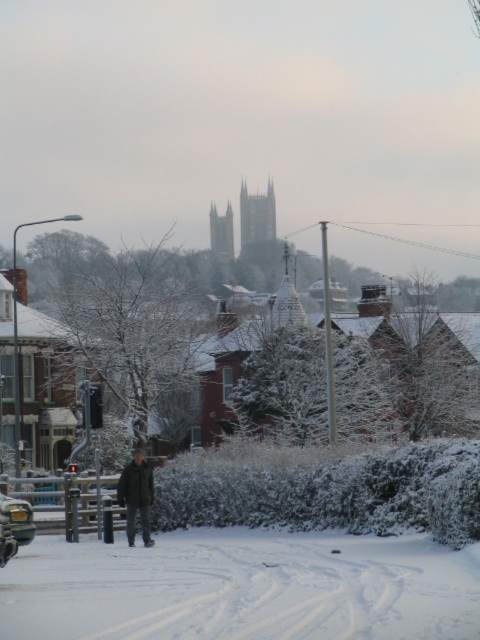
Who is lower down, white powdery snow at lower center or dark brown leather jacket at center?

dark brown leather jacket at center

Is point (391, 554) in front of point (141, 493)?

Yes, it is in front of point (141, 493).

Describe the element at coordinates (241, 586) in the screenshot. This screenshot has height=640, width=480. I see `white powdery snow at lower center` at that location.

Locate an element on the screen. white powdery snow at lower center is located at coordinates (241, 586).

Which is below, white powdery snow at lower center or metallic silver car at lower left?

white powdery snow at lower center

At what (x,y) coordinates should I click in order to perform the action: click on white powdery snow at lower center. Please return your answer as a coordinate pair (x, y). This screenshot has width=480, height=640. Looking at the image, I should click on (241, 586).

Find the location of a particular element. white powdery snow at lower center is located at coordinates (241, 586).

Is the position of dark brown leather jacket at center less distant than that of metallic silver car at lower left?

No, dark brown leather jacket at center is further to the viewer.

Between point (118, 488) and point (12, 531), which one is positioned in front?

Point (12, 531) is in front.

This screenshot has height=640, width=480. What are the coordinates of `dark brown leather jacket at center` in the screenshot? It's located at (136, 496).